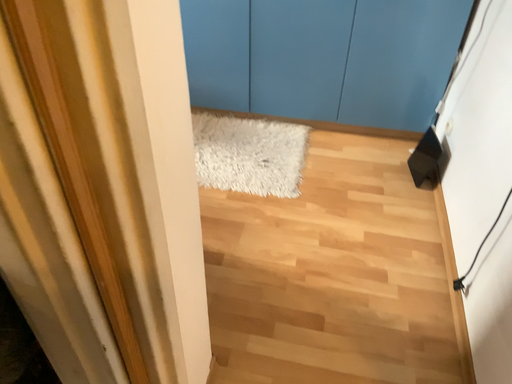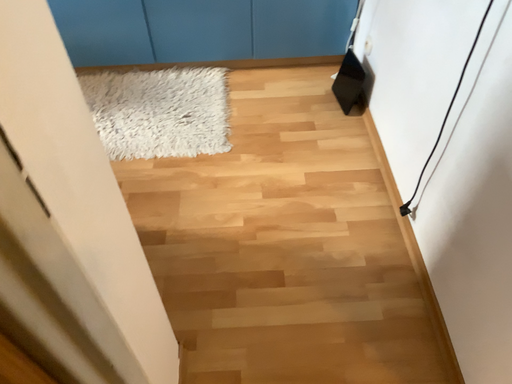
Question: How did the camera likely rotate when shooting the video?

Choices:
 (A) rotated right
 (B) rotated left

Answer: (A)